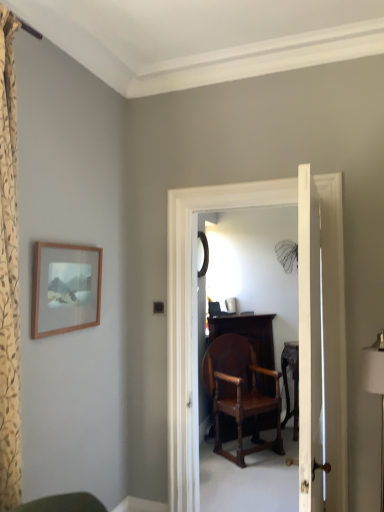
Question: Does wooden carved table at center have a larger size compared to white fabric lampshade at right?

Choices:
 (A) no
 (B) yes

Answer: (B)

Question: From the image's perspective, is wooden carved table at center beneath white fabric lampshade at right?

Choices:
 (A) no
 (B) yes

Answer: (B)

Question: From the image's perspective, is wooden carved table at center on white fabric lampshade at right?

Choices:
 (A) no
 (B) yes

Answer: (A)

Question: Does wooden carved table at center have a greater height compared to white fabric lampshade at right?

Choices:
 (A) yes
 (B) no

Answer: (B)

Question: From a real-world perspective, is wooden carved table at center physically above white fabric lampshade at right?

Choices:
 (A) no
 (B) yes

Answer: (A)

Question: Looking at the image, does white wooden door at center seem bigger or smaller compared to black glass mirror at center?

Choices:
 (A) big
 (B) small

Answer: (A)

Question: From a real-world perspective, relative to black glass mirror at center, is white wooden door at center vertically above or below?

Choices:
 (A) below
 (B) above

Answer: (A)

Question: Is white wooden door at center situated inside black glass mirror at center or outside?

Choices:
 (A) outside
 (B) inside

Answer: (A)

Question: In the image, is white wooden door at center positioned in front of or behind black glass mirror at center?

Choices:
 (A) front
 (B) behind

Answer: (A)

Question: Is point (205, 266) closer or farther from the camera than point (94, 263)?

Choices:
 (A) closer
 (B) farther

Answer: (B)

Question: Relative to wooden picture frame at upper left, is black glass mirror at center in front or behind?

Choices:
 (A) front
 (B) behind

Answer: (B)

Question: Considering the positions of black glass mirror at center and wooden picture frame at upper left in the image, is black glass mirror at center bigger or smaller than wooden picture frame at upper left?

Choices:
 (A) small
 (B) big

Answer: (A)

Question: Would you say black glass mirror at center is inside or outside wooden picture frame at upper left?

Choices:
 (A) inside
 (B) outside

Answer: (B)

Question: Is black glass mirror at center to the left or to the right of mahogany wood chair at center in the image?

Choices:
 (A) right
 (B) left

Answer: (B)

Question: From their relative heights in the image, would you say black glass mirror at center is taller or shorter than mahogany wood chair at center?

Choices:
 (A) short
 (B) tall

Answer: (A)